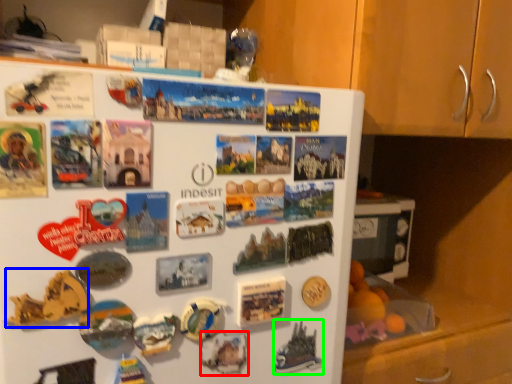
Question: Which object is positioned closest to art (highlighted by a red box)? Select from art (highlighted by a blue box) and art (highlighted by a green box).

Choices:
 (A) art
 (B) art

Answer: (B)